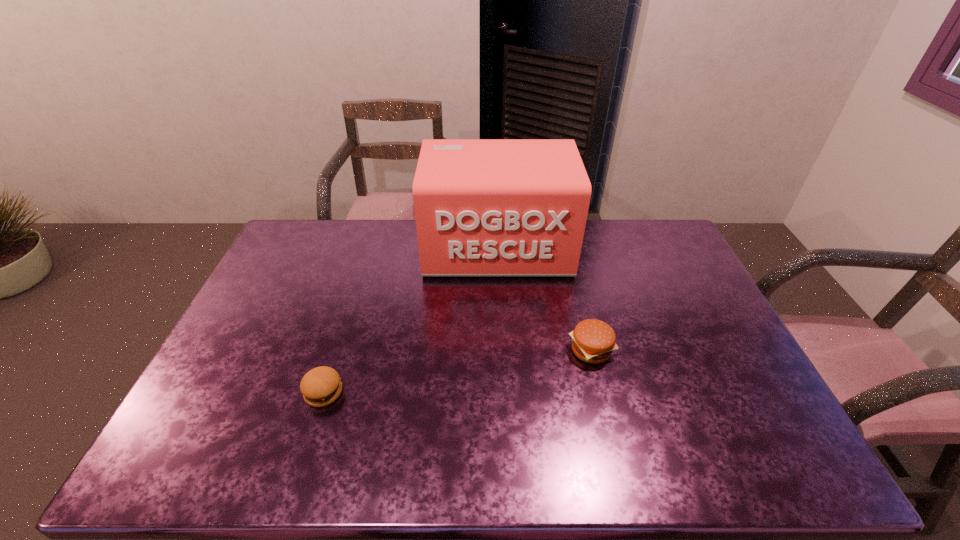
The height and width of the screenshot is (540, 960). Find the location of `empty space that is in between the right hamburger and the tallest object`. empty space that is in between the right hamburger and the tallest object is located at coordinates (544, 299).

Locate an element on the screen. This screenshot has height=540, width=960. free spot between the second shortest object and the shorter hamburger is located at coordinates (457, 371).

This screenshot has width=960, height=540. I want to click on vacant point located between the farthest object and the nearest object, so click(411, 320).

Find the location of a particular element. The height and width of the screenshot is (540, 960). free space between the second farthest object and the tallest object is located at coordinates (544, 299).

At what (x,y) coordinates should I click in order to perform the action: click on vacant area that lies between the shortest object and the box. Please return your answer as a coordinate pair (x, y). This screenshot has height=540, width=960. Looking at the image, I should click on (411, 320).

Select which object is the closest to the farthest object. Please provide its 2D coordinates. Your answer should be formatted as a tuple, i.e. [(x, y)], where the tuple contains the x and y coordinates of a point satisfying the conditions above.

[(593, 341)]

This screenshot has height=540, width=960. Find the location of `object that is the closest one to the right hamburger`. object that is the closest one to the right hamburger is located at coordinates (483, 207).

Where is `vacant area in the image that satisfies the following two spatial constraints: 1. on the surface of the tallest object where the text is embossed; 2. on the right side of the second tallest object`? The width and height of the screenshot is (960, 540). vacant area in the image that satisfies the following two spatial constraints: 1. on the surface of the tallest object where the text is embossed; 2. on the right side of the second tallest object is located at coordinates (503, 350).

At what (x,y) coordinates should I click in order to perform the action: click on free space that satisfies the following two spatial constraints: 1. on the surface of the farther hamburger where the text is embossed; 2. on the right side of the farthest object. Please return your answer as a coordinate pair (x, y). Image resolution: width=960 pixels, height=540 pixels. Looking at the image, I should click on (503, 350).

You are a GUI agent. You are given a task and a screenshot of the screen. Output one action in this format:
    pyautogui.click(x=<x>, y=<y>)
    Task: Click on the vacant region that satisfies the following two spatial constraints: 1. on the surface of the farther hamburger where the text is embossed; 2. on the left side of the farthest object
    
    Given the screenshot: What is the action you would take?
    pyautogui.click(x=503, y=350)